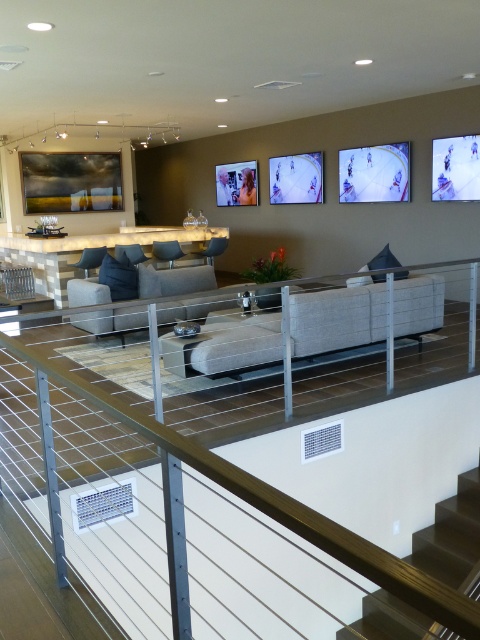
You are a guest entering the living space and want to sit on the neutral fabric couch at center. From your current position at the entrance, which direction should you walk to reach the couch without passing through the dark wood stairs at lower right?

Since the dark wood stairs at lower right is behind the neutral fabric couch at center, you should walk towards the neutral fabric couch at center and avoid the area near the stairs by moving around the side opposite to the stairs.

You are a delivery person carrying a large package that is 1 meter wide. You need to navigate through the living space to reach the lounge area. Can you pass through the gap between the white metal rail at lower center and the dark wood stairs at lower right without tilting the package?

The white metal rail at lower center is bigger than the dark wood stairs at lower right. Since the package is 1 meter wide, you need to check the width of the gap between them. However, the description only states the size comparison between the objects, not the actual gap width. Therefore, it is uncertain if the package can pass through without tilting.

You are a visitor standing at the entrance of the living space. You need to determine if you can safely step over the white metal rail at lower center to reach the dark wood stairs at lower right. Based on their heights, is this possible?

The white metal rail at lower center is much taller than the dark wood stairs at lower right, so stepping over the rail might be difficult due to its greater height compared to the stairs.